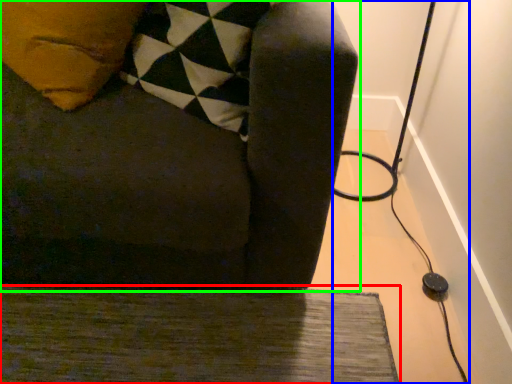
Question: Which object is positioned farthest from doormat (highlighted by a red box)? Select from cable (highlighted by a blue box) and furniture (highlighted by a green box).

Choices:
 (A) cable
 (B) furniture

Answer: (A)